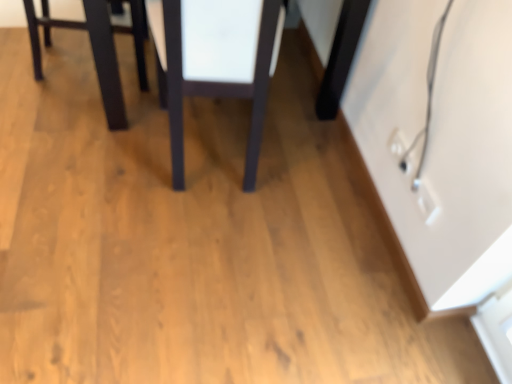
Question: Which is correct: matte black table at upper left is inside matte dark wood table at center, or outside of it?

Choices:
 (A) inside
 (B) outside

Answer: (B)

Question: Would you say matte black table at upper left is to the left or to the right of matte dark wood table at center in the picture?

Choices:
 (A) left
 (B) right

Answer: (A)

Question: Looking at the image, does matte black table at upper left seem bigger or smaller compared to matte dark wood table at center?

Choices:
 (A) small
 (B) big

Answer: (A)

Question: From the image's perspective, is matte dark wood table at center above or below matte black table at upper left?

Choices:
 (A) below
 (B) above

Answer: (A)

Question: Considering the positions of point (242, 92) and point (48, 16), is point (242, 92) closer or farther from the camera than point (48, 16)?

Choices:
 (A) closer
 (B) farther

Answer: (A)

Question: Is matte dark wood table at center taller or shorter than matte black table at upper left?

Choices:
 (A) tall
 (B) short

Answer: (A)

Question: From a real-world perspective, is matte dark wood table at center physically located above or below matte black table at upper left?

Choices:
 (A) above
 (B) below

Answer: (A)